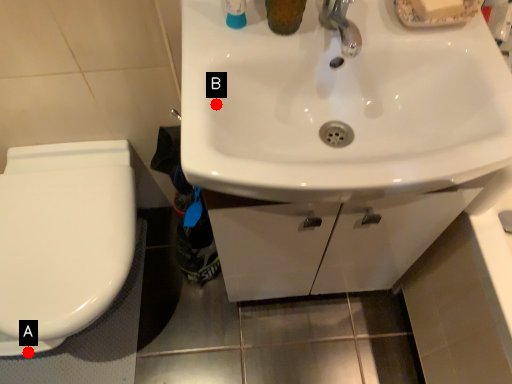
Question: Two points are circled on the image, labeled by A and B beside each circle. Which point is closer to the camera?

Choices:
 (A) A is closer
 (B) B is closer

Answer: (B)